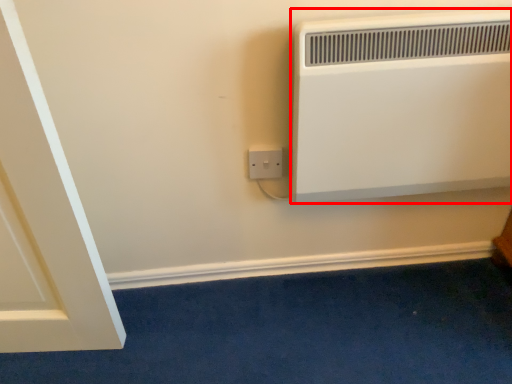
Question: From the image's perspective, what is the correct spatial relationship of heater (annotated by the red box) in relation to power plugs and sockets?

Choices:
 (A) below
 (B) above

Answer: (B)